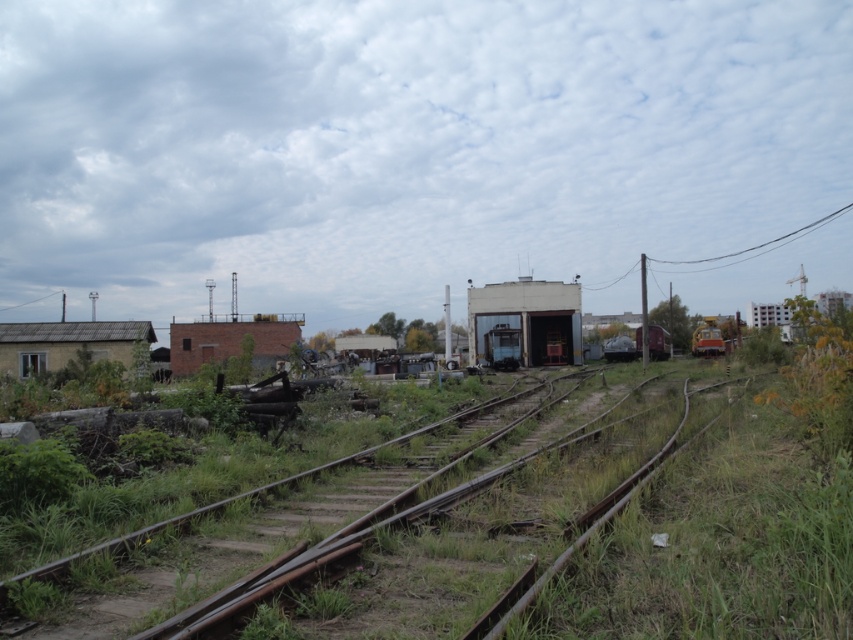
You are a maintenance worker needing to place the yellow metallic train car at right onto the rusty metal track at center. Based on the scene description, will the train car fit on the track?

The rusty metal track at center is shorter than the yellow metallic train car at right, so the train car will not fit on the track.

You are a maintenance worker inspecting the railway yard. You notice the rusty metal track at center and the yellow metallic train car at right. Which object is closer to you from your current position?

The rusty metal track at center is closer to you because it is in front of the yellow metallic train car at right, indicating it is nearer in the scene.

You are a maintenance worker needing to reach the yellow metallic train car at right from the rusty metal track at center. Given that your equipment can only travel 40 meters, will you be able to reach it?

The rusty metal track at center is 39.45 meters from the yellow metallic train car at right, so yes, the equipment can reach it since the distance is within the 40 meters limit.